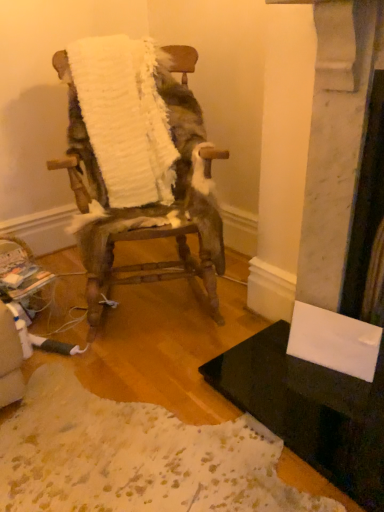
Where is `black glossy table at lower right`? The width and height of the screenshot is (384, 512). black glossy table at lower right is located at coordinates (310, 410).

This screenshot has width=384, height=512. In order to click on black glossy table at lower right in this screenshot , I will do `click(310, 410)`.

Is white fluffy chair at center inside the boundaries of white fluffy blanket at center, or outside?

white fluffy chair at center cannot be found inside white fluffy blanket at center.

Is white fluffy chair at center in front of or behind white fluffy blanket at center in the image?

Clearly, white fluffy chair at center is in front of white fluffy blanket at center.

Is white fluffy chair at center turned away from white fluffy blanket at center?

Correct, white fluffy chair at center is looking away from white fluffy blanket at center.

This screenshot has width=384, height=512. In order to click on blanket behind the black glossy table at lower right in this screenshot , I will do `click(125, 118)`.

Is white fluffy blanket at center positioned before black glossy table at lower right?

No, it is not.

Is white fluffy blanket at center oriented towards black glossy table at lower right?

Yes, white fluffy blanket at center faces towards black glossy table at lower right.

In terms of height, does white fluffy blanket at center look taller or shorter compared to black glossy table at lower right?

Considering their sizes, white fluffy blanket at center has more height than black glossy table at lower right.

In terms of size, does white fluffy chair at center appear bigger or smaller than black glossy table at lower right?

Clearly, white fluffy chair at center is larger in size than black glossy table at lower right.

Between white fluffy chair at center and black glossy table at lower right, which one has less height?

black glossy table at lower right.

Which is more to the left, white fluffy chair at center or black glossy table at lower right?

From the viewer's perspective, white fluffy chair at center appears more on the left side.

From the image's perspective, is black glossy table at lower right beneath white fluffy chair at center?

Yes, from the image's perspective, black glossy table at lower right is beneath white fluffy chair at center.

Are black glossy table at lower right and white fluffy chair at center beside each other?

No, black glossy table at lower right is not touching white fluffy chair at center.

Is white fluffy blanket at center wider or thinner than white fluffy chair at center?

white fluffy blanket at center is thinner than white fluffy chair at center.

Is point (167, 202) farther from viewer compared to point (194, 103)?

Yes, it is.

Is white fluffy blanket at center positioned with its back to white fluffy chair at center?

Yes, white fluffy blanket at center's orientation is away from white fluffy chair at center.

In the image, there is a white fluffy blanket at center. At what (x,y) coordinates should I click in order to perform the action: click on chair below it (from a real-world perspective). Please return your answer as a coordinate pair (x, y). Looking at the image, I should click on (150, 203).

This screenshot has height=512, width=384. I want to click on table below the white fluffy blanket at center (from the image's perspective), so click(310, 410).

Is point (230, 396) more distant than point (119, 155)?

No, (230, 396) is closer to viewer.

Considering the relative sizes of black glossy table at lower right and white fluffy blanket at center in the image provided, is black glossy table at lower right bigger than white fluffy blanket at center?

Incorrect, black glossy table at lower right is not larger than white fluffy blanket at center.

Does black glossy table at lower right have a lesser height compared to white fluffy blanket at center?

Yes.

You are a GUI agent. You are given a task and a screenshot of the screen. Output one action in this format:
    pyautogui.click(x=<x>, y=<y>)
    Task: Click on the blanket above the white fluffy chair at center (from the image's perspective)
    This screenshot has width=384, height=512.
    Given the screenshot: What is the action you would take?
    pyautogui.click(x=125, y=118)

Image resolution: width=384 pixels, height=512 pixels. Identify the location of table to the right of white fluffy blanket at center. (310, 410).

Considering their positions, is white fluffy chair at center positioned closer to white fluffy blanket at center than black glossy table at lower right?

Among the two, white fluffy chair at center is located nearer to white fluffy blanket at center.

Considering their positions, is black glossy table at lower right positioned further to white fluffy blanket at center than white fluffy chair at center?

black glossy table at lower right is further to white fluffy blanket at center.

From the image, which object appears to be nearer to black glossy table at lower right, white fluffy chair at center or white fluffy blanket at center?

Among the two, white fluffy chair at center is located nearer to black glossy table at lower right.

Based on their spatial positions, is white fluffy blanket at center or black glossy table at lower right closer to white fluffy chair at center?

white fluffy blanket at center.

From the image, which object appears to be nearer to black glossy table at lower right, white fluffy blanket at center or white fluffy chair at center?

Based on the image, white fluffy chair at center appears to be nearer to black glossy table at lower right.

Considering their positions, is black glossy table at lower right positioned closer to white fluffy chair at center than white fluffy blanket at center?

Among the two, white fluffy blanket at center is located nearer to white fluffy chair at center.

Where is `chair between white fluffy blanket at center and black glossy table at lower right in the vertical direction`? This screenshot has height=512, width=384. chair between white fluffy blanket at center and black glossy table at lower right in the vertical direction is located at coordinates (150, 203).